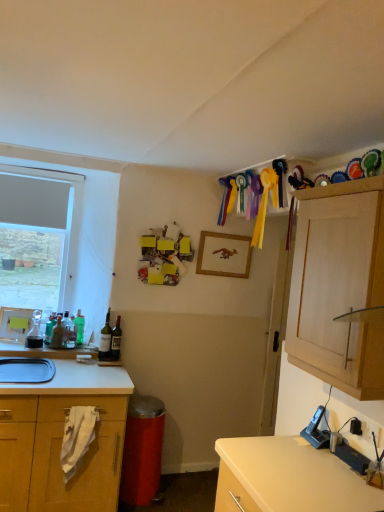
Question: From a real-world perspective, is green matte bottle at left, which is counted as the fourth bottle, starting from the left, beneath translucent glass carafe at left, arranged as the first bottle when viewed from the left?

Choices:
 (A) yes
 (B) no

Answer: (A)

Question: Considering the relative sizes of green matte bottle at left, which is counted as the third bottle, starting from the right, and translucent glass carafe at left, arranged as the first bottle when viewed from the left, in the image provided, is green matte bottle at left, which is counted as the third bottle, starting from the right, wider than translucent glass carafe at left, arranged as the first bottle when viewed from the left,?

Choices:
 (A) yes
 (B) no

Answer: (B)

Question: Is the depth of green matte bottle at left, which is counted as the third bottle, starting from the right, less than that of translucent glass carafe at left, arranged as the first bottle when viewed from the left?

Choices:
 (A) no
 (B) yes

Answer: (A)

Question: From the image's perspective, is green matte bottle at left, which is counted as the fourth bottle, starting from the left, located beneath translucent glass carafe at left, arranged as the 6th bottle when viewed from the right?

Choices:
 (A) no
 (B) yes

Answer: (B)

Question: Would you say green matte bottle at left, which is counted as the third bottle, starting from the right, is outside translucent glass carafe at left, arranged as the 6th bottle when viewed from the right?

Choices:
 (A) yes
 (B) no

Answer: (A)

Question: From the image's perspective, is green matte bottle at left, which is counted as the third bottle, starting from the right, on translucent glass carafe at left, arranged as the 6th bottle when viewed from the right?

Choices:
 (A) yes
 (B) no

Answer: (B)

Question: Does matte white sink at lower left have a greater height compared to white laminate countertop at lower left?

Choices:
 (A) yes
 (B) no

Answer: (A)

Question: Does matte white sink at lower left have a lesser width compared to white laminate countertop at lower left?

Choices:
 (A) no
 (B) yes

Answer: (B)

Question: Is matte white sink at lower left to the left of white laminate countertop at lower left from the viewer's perspective?

Choices:
 (A) no
 (B) yes

Answer: (A)

Question: Does matte white sink at lower left come behind white laminate countertop at lower left?

Choices:
 (A) no
 (B) yes

Answer: (A)

Question: From the image's perspective, is matte white sink at lower left below white laminate countertop at lower left?

Choices:
 (A) no
 (B) yes

Answer: (B)

Question: Is matte white sink at lower left oriented towards white laminate countertop at lower left?

Choices:
 (A) no
 (B) yes

Answer: (A)

Question: Is translucent glass bottle at left, the 5th bottle viewed from the right, not near white laminate countertop at lower left?

Choices:
 (A) no
 (B) yes

Answer: (A)